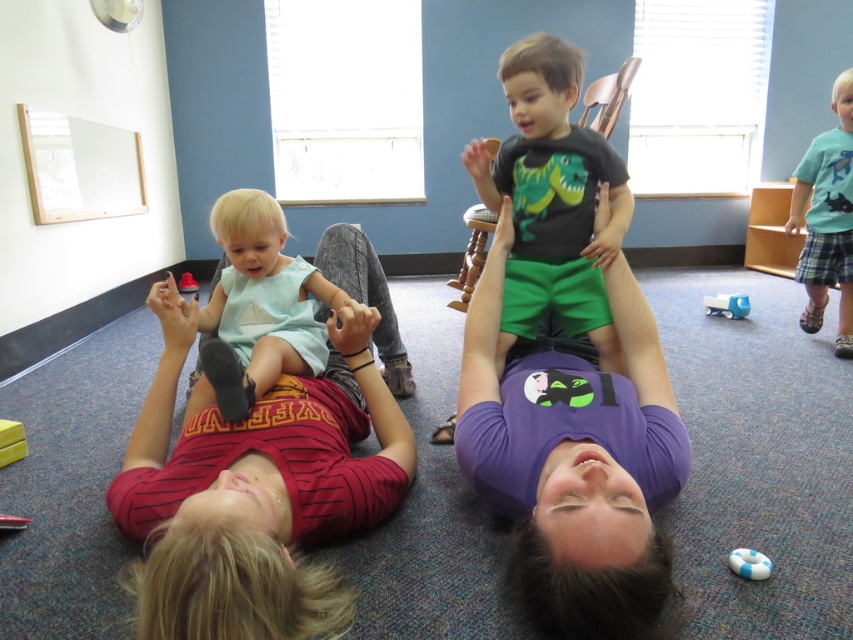
You are a photographer trying to capture a photo of the blue plastic toy at center without including the blue plaid shorts at right in the frame. Based on their positions, is this possible?

The blue plaid shorts at right is located above the blue plastic toy at center, so if you position the camera below the blue plastic toy at center and aim upwards, you can exclude the blue plaid shorts at right from the frame.

You are standing in the room and want to take a photo of the point at coordinates (473, 179). The camera you are using has a minimum focus distance of 2 meters. Will the camera be able to focus on the point?

The point at coordinates (473, 179) is 2.32 meters from the camera, which is beyond the minimum focus distance of 2 meters. Therefore, the camera should be able to focus on the point.